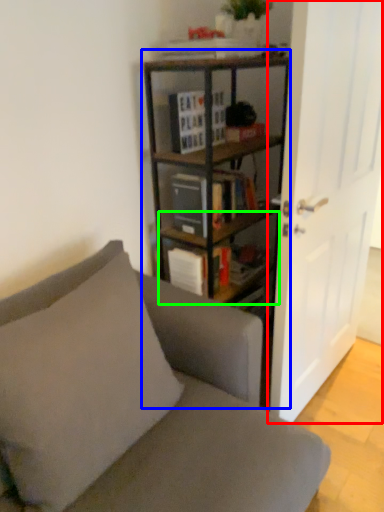
Question: Which object is the closest to the door (highlighted by a red box)? Choose among these: bookcase (highlighted by a blue box) or shelf (highlighted by a green box).

Choices:
 (A) bookcase
 (B) shelf

Answer: (A)